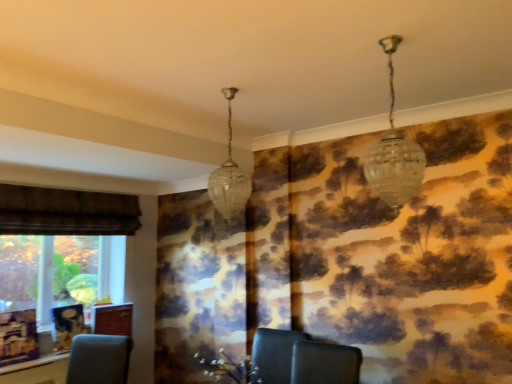
What do you see at coordinates (229, 176) in the screenshot? The width and height of the screenshot is (512, 384). I see `clear glass pendant light at center, positioned as the second lamp in front-to-back order` at bounding box center [229, 176].

In order to face clear glass pendant light at center, the 2th lamp positioned from the right, should I rotate leftwards or rightwards?

To align with it, rotate left about 3.550°.

Identify the location of clear glass pendant light at center, which is counted as the 1th lamp, starting from the back. This screenshot has width=512, height=384. (229, 176).

Based on the photo, measure the distance between point [211,176] and camera.

A distance of 2.31 meters exists between point [211,176] and camera.

This screenshot has width=512, height=384. What do you see at coordinates (394, 153) in the screenshot? I see `clear glass chandelier at upper right, acting as the 1th lamp starting from the front` at bounding box center [394, 153].

In order to click on clear glass chandelier at upper right, which is counted as the 2th lamp, starting from the back in this screenshot , I will do `click(394, 153)`.

What is the approximate height of clear glass chandelier at upper right, the second lamp from the left?

The height of clear glass chandelier at upper right, the second lamp from the left, is 72.40 centimeters.

This screenshot has width=512, height=384. Find the location of `clear glass pendant light at center, which is counted as the 1th lamp, starting from the back`. clear glass pendant light at center, which is counted as the 1th lamp, starting from the back is located at coordinates (229, 176).

Does clear glass pendant light at center, which is the 1th lamp in left-to-right order, appear on the right side of clear glass chandelier at upper right, acting as the 1th lamp starting from the front?

In fact, clear glass pendant light at center, which is the 1th lamp in left-to-right order, is to the left of clear glass chandelier at upper right, acting as the 1th lamp starting from the front.

In the scene shown: Is clear glass pendant light at center, positioned as the second lamp in front-to-back order, in front of or behind clear glass chandelier at upper right, which is counted as the 2th lamp, starting from the back, in the image?

clear glass pendant light at center, positioned as the second lamp in front-to-back order, is positioned farther from the viewer than clear glass chandelier at upper right, which is counted as the 2th lamp, starting from the back.

Between point (234, 87) and point (394, 162), which one is positioned in front?

The point (394, 162) is more forward.

From the image's perspective, does clear glass pendant light at center, the 2th lamp positioned from the right, appear higher than clear glass chandelier at upper right, which is counted as the 2th lamp, starting from the back?

No, from the image's perspective, clear glass pendant light at center, the 2th lamp positioned from the right, is not over clear glass chandelier at upper right, which is counted as the 2th lamp, starting from the back.

From a real-world perspective, who is located lower, clear glass pendant light at center, which is counted as the 1th lamp, starting from the back, or clear glass chandelier at upper right, which is the 1th lamp in right-to-left order?

clear glass pendant light at center, which is counted as the 1th lamp, starting from the back, from a real-world perspective.

Considering the sizes of objects clear glass pendant light at center, the 2th lamp positioned from the right, and clear glass chandelier at upper right, the second lamp from the left, in the image provided, who is wider, clear glass pendant light at center, the 2th lamp positioned from the right, or clear glass chandelier at upper right, the second lamp from the left,?

clear glass chandelier at upper right, the second lamp from the left, is wider.

Which of these two, clear glass pendant light at center, which is the 1th lamp in left-to-right order, or clear glass chandelier at upper right, acting as the 1th lamp starting from the front, stands shorter?

Standing shorter between the two is clear glass chandelier at upper right, acting as the 1th lamp starting from the front.

Who is smaller, clear glass pendant light at center, which is counted as the 1th lamp, starting from the back, or clear glass chandelier at upper right, which is the 1th lamp in right-to-left order?

clear glass pendant light at center, which is counted as the 1th lamp, starting from the back.

Is clear glass chandelier at upper right, which is counted as the 2th lamp, starting from the back, located within clear glass pendant light at center, which is counted as the 1th lamp, starting from the back?

Actually, clear glass chandelier at upper right, which is counted as the 2th lamp, starting from the back, is outside clear glass pendant light at center, which is counted as the 1th lamp, starting from the back.

Is clear glass pendant light at center, the 2th lamp positioned from the right, far from clear glass chandelier at upper right, acting as the 1th lamp starting from the front?

No, clear glass pendant light at center, the 2th lamp positioned from the right, is in close proximity to clear glass chandelier at upper right, acting as the 1th lamp starting from the front.

Is clear glass pendant light at center, positioned as the second lamp in front-to-back order, oriented away from clear glass chandelier at upper right, which is the 1th lamp in right-to-left order?

clear glass pendant light at center, positioned as the second lamp in front-to-back order, is not turned away from clear glass chandelier at upper right, which is the 1th lamp in right-to-left order.

From the picture: How many degrees apart are the facing directions of clear glass pendant light at center, which is counted as the 1th lamp, starting from the back, and clear glass chandelier at upper right, acting as the 1th lamp starting from the front?

There is a 3.05-degree angle between the facing directions of clear glass pendant light at center, which is counted as the 1th lamp, starting from the back, and clear glass chandelier at upper right, acting as the 1th lamp starting from the front.

Measure the distance between clear glass pendant light at center, which is the 1th lamp in left-to-right order, and clear glass chandelier at upper right, the second lamp from the left.

clear glass pendant light at center, which is the 1th lamp in left-to-right order, and clear glass chandelier at upper right, the second lamp from the left, are 32.13 inches apart.

Find the location of `lamp behind the clear glass chandelier at upper right, which is counted as the 2th lamp, starting from the back`. lamp behind the clear glass chandelier at upper right, which is counted as the 2th lamp, starting from the back is located at coordinates (229, 176).

Considering the relative positions of clear glass chandelier at upper right, which is the 1th lamp in right-to-left order, and clear glass pendant light at center, which is counted as the 1th lamp, starting from the back, in the image provided, is clear glass chandelier at upper right, which is the 1th lamp in right-to-left order, to the left of clear glass pendant light at center, which is counted as the 1th lamp, starting from the back, from the viewer's perspective?

In fact, clear glass chandelier at upper right, which is the 1th lamp in right-to-left order, is to the right of clear glass pendant light at center, which is counted as the 1th lamp, starting from the back.

Is clear glass chandelier at upper right, which is the 1th lamp in right-to-left order, further to the viewer compared to clear glass pendant light at center, the 2th lamp positioned from the right?

That is False.

Considering the positions of point (398, 187) and point (242, 208), is point (398, 187) closer or farther from the camera than point (242, 208)?

Clearly, point (398, 187) is closer to the camera than point (242, 208).

From the image's perspective, is clear glass chandelier at upper right, which is the 1th lamp in right-to-left order, under clear glass pendant light at center, which is the 1th lamp in left-to-right order?

No.

Consider the image. From a real-world perspective, is clear glass chandelier at upper right, which is counted as the 2th lamp, starting from the back, positioned over clear glass pendant light at center, positioned as the second lamp in front-to-back order, based on gravity?

Yes.

Between clear glass chandelier at upper right, which is counted as the 2th lamp, starting from the back, and clear glass pendant light at center, positioned as the second lamp in front-to-back order, which one has larger width?

With larger width is clear glass chandelier at upper right, which is counted as the 2th lamp, starting from the back.

Between clear glass chandelier at upper right, which is the 1th lamp in right-to-left order, and clear glass pendant light at center, which is the 1th lamp in left-to-right order, which one has more height?

Standing taller between the two is clear glass pendant light at center, which is the 1th lamp in left-to-right order.

Who is smaller, clear glass chandelier at upper right, which is counted as the 2th lamp, starting from the back, or clear glass pendant light at center, the 2th lamp positioned from the right?

clear glass pendant light at center, the 2th lamp positioned from the right, is smaller.

Can we say clear glass chandelier at upper right, which is counted as the 2th lamp, starting from the back, lies outside clear glass pendant light at center, which is the 1th lamp in left-to-right order?

Indeed, clear glass chandelier at upper right, which is counted as the 2th lamp, starting from the back, is completely outside clear glass pendant light at center, which is the 1th lamp in left-to-right order.

Are clear glass chandelier at upper right, which is counted as the 2th lamp, starting from the back, and clear glass pendant light at center, positioned as the second lamp in front-to-back order, far apart?

clear glass chandelier at upper right, which is counted as the 2th lamp, starting from the back, is near clear glass pendant light at center, positioned as the second lamp in front-to-back order, not far away.

Is clear glass chandelier at upper right, acting as the 1th lamp starting from the front, oriented away from clear glass pendant light at center, positioned as the second lamp in front-to-back order?

No, clear glass chandelier at upper right, acting as the 1th lamp starting from the front, is not facing the opposite direction of clear glass pendant light at center, positioned as the second lamp in front-to-back order.

Can you tell me how much clear glass chandelier at upper right, acting as the 1th lamp starting from the front, and clear glass pendant light at center, which is counted as the 1th lamp, starting from the back, differ in facing direction?

There is a 3.05-degree angle between the facing directions of clear glass chandelier at upper right, acting as the 1th lamp starting from the front, and clear glass pendant light at center, which is counted as the 1th lamp, starting from the back.

How distant is clear glass chandelier at upper right, acting as the 1th lamp starting from the front, from clear glass pendant light at center, which is counted as the 1th lamp, starting from the back?

A distance of 32.13 inches exists between clear glass chandelier at upper right, acting as the 1th lamp starting from the front, and clear glass pendant light at center, which is counted as the 1th lamp, starting from the back.

I want to click on lamp on the right of the clear glass pendant light at center, the 2th lamp positioned from the right, so click(394, 153).

The width and height of the screenshot is (512, 384). What are the coordinates of `lamp below the clear glass chandelier at upper right, the second lamp from the left (from the image's perspective)` in the screenshot? It's located at (229, 176).

You are a GUI agent. You are given a task and a screenshot of the screen. Output one action in this format:
    pyautogui.click(x=<x>, y=<y>)
    Task: Click on the lamp on the right side of clear glass pendant light at center, the 2th lamp positioned from the right
    This screenshot has height=384, width=512.
    Given the screenshot: What is the action you would take?
    pyautogui.click(x=394, y=153)